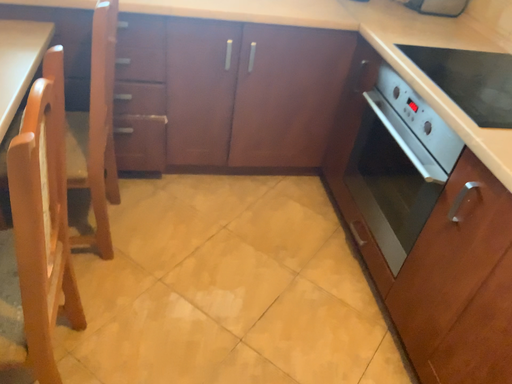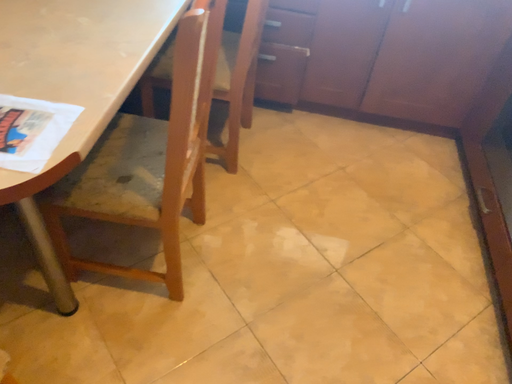
Question: Which way did the camera rotate in the video?

Choices:
 (A) rotated left
 (B) rotated right

Answer: (A)